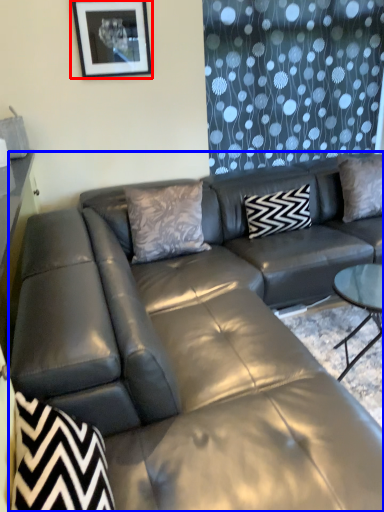
Question: Which object is closer to the camera taking this photo, picture frame (highlighted by a red box) or studio couch (highlighted by a blue box)?

Choices:
 (A) picture frame
 (B) studio couch

Answer: (B)